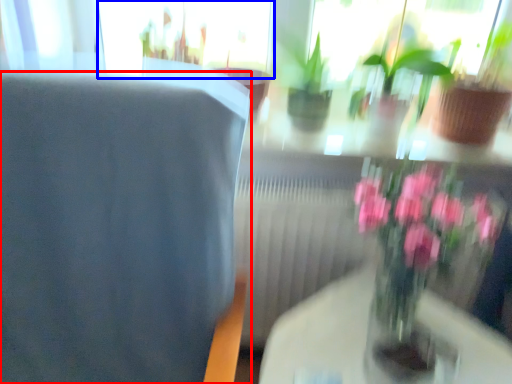
Question: Which object is further to the camera taking this photo, chair (highlighted by a red box) or glass door (highlighted by a blue box)?

Choices:
 (A) chair
 (B) glass door

Answer: (B)